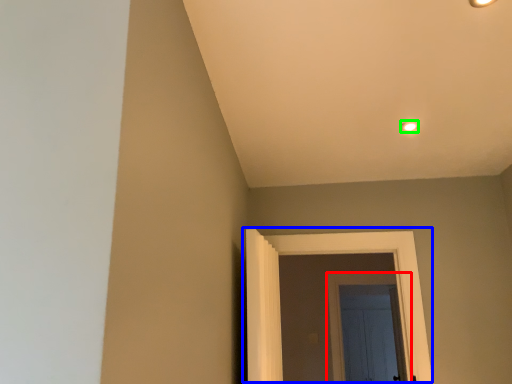
Question: Based on their relative distances, which object is farther from door (highlighted by a red box)? Choose from door (highlighted by a blue box) and light fixture (highlighted by a green box).

Choices:
 (A) door
 (B) light fixture

Answer: (B)